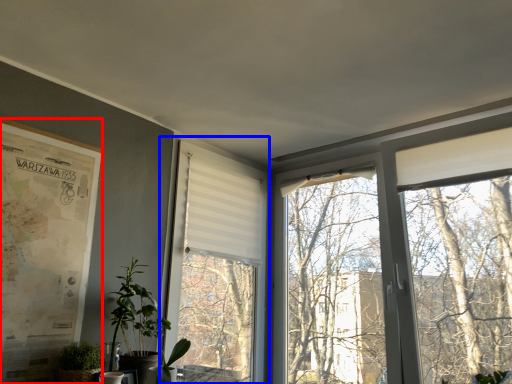
Question: Which object is closer to the camera taking this photo, poster page (highlighted by a red box) or window screen (highlighted by a blue box)?

Choices:
 (A) poster page
 (B) window screen

Answer: (A)